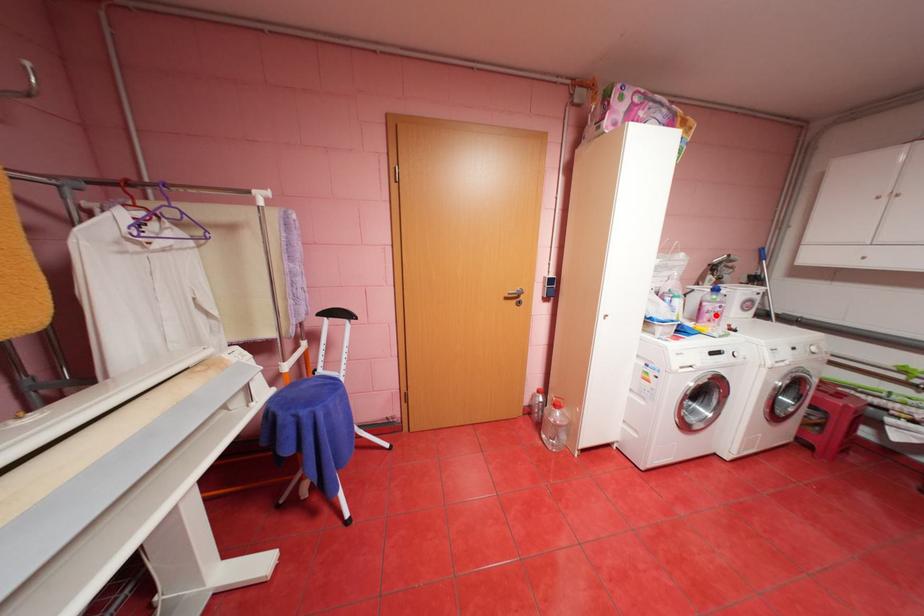
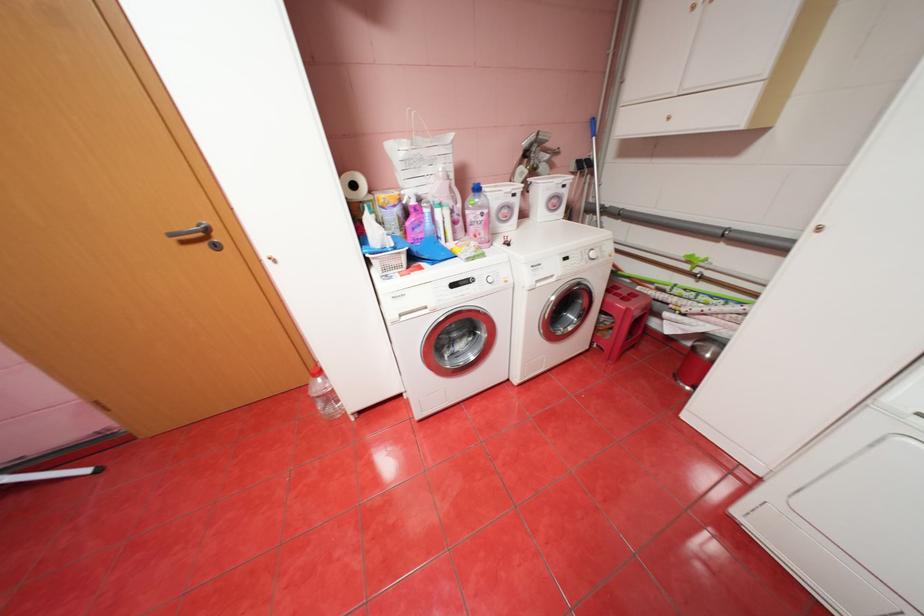
Where in the second image is the point corresponding to the highlighted location from the first image?

(480, 228)